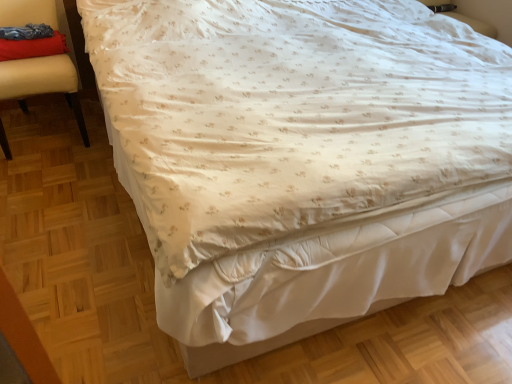
At what (x,y) coordinates should I click in order to perform the action: click on free space underneath velvet red cushion at left (from a real-world perspective). Please return your answer as a coordinate pair (x, y). This screenshot has height=384, width=512. Looking at the image, I should click on (49, 130).